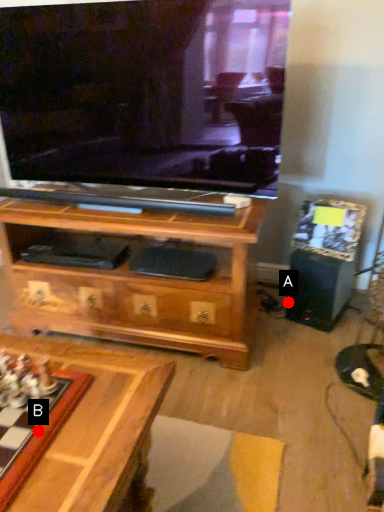
Question: Two points are circled on the image, labeled by A and B beside each circle. Which point is farther from the camera taking this photo?

Choices:
 (A) A is further
 (B) B is further

Answer: (A)